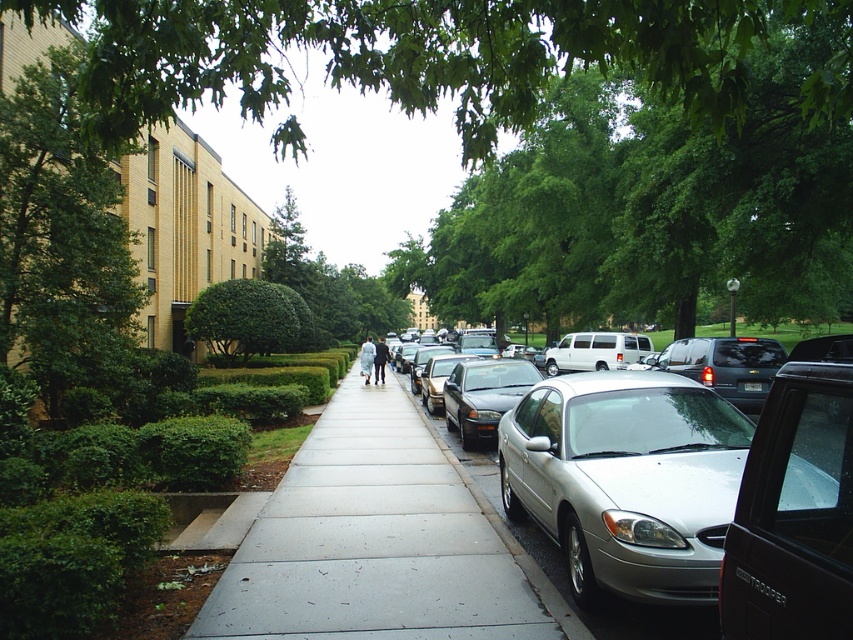
Question: Does green leafy tree at center have a lesser width compared to dark blue suit at center?

Choices:
 (A) yes
 (B) no

Answer: (B)

Question: Which of these objects is positioned farthest from the green leafy tree at center?

Choices:
 (A) silver metallic sedan at center
 (B) green leafy tree at upper center
 (C) gray concrete sidewalk at center

Answer: (A)

Question: Estimate the real-world distances between objects in this image. Which object is farther from the silver metallic sedan at center?

Choices:
 (A) gray concrete sidewalk at center
 (B) green leafy tree at upper center

Answer: (B)

Question: Does green leafy tree at center lie in front of light blue fabric dress at center?

Choices:
 (A) yes
 (B) no

Answer: (A)

Question: Which object appears farthest from the camera in this image?

Choices:
 (A) green leafy tree at upper center
 (B) dark blue suit at center
 (C) green leafy tree at center

Answer: (B)

Question: Does silver metallic sedan at center appear over shiny silver sedan at center right?

Choices:
 (A) yes
 (B) no

Answer: (A)